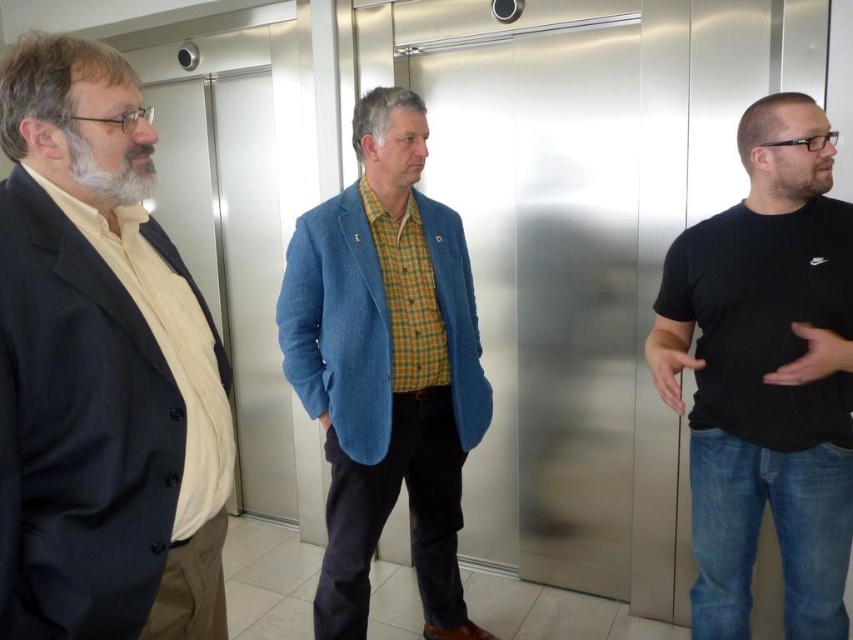
Does matte black suit at left appear on the right side of blue corduroy blazer at center?

Incorrect, matte black suit at left is not on the right side of blue corduroy blazer at center.

Who is lower down, matte black suit at left or blue corduroy blazer at center?

blue corduroy blazer at center

Image resolution: width=853 pixels, height=640 pixels. What are the coordinates of `matte black suit at left` in the screenshot? It's located at (102, 369).

Identify the location of matte black suit at left. The image size is (853, 640). (102, 369).

Can you confirm if matte black suit at left is shorter than black cotton t-shirt at right?

Yes.

Image resolution: width=853 pixels, height=640 pixels. I want to click on matte black suit at left, so click(102, 369).

Does black cotton t-shirt at right appear over blue corduroy blazer at center?

Indeed, black cotton t-shirt at right is positioned over blue corduroy blazer at center.

Between point (741, 492) and point (376, 212), which one is positioned in front?

Point (741, 492) is in front.

Measure the distance between black cotton t-shirt at right and camera.

The distance of black cotton t-shirt at right from camera is 1.44 meters.

Identify the location of black cotton t-shirt at right. Image resolution: width=853 pixels, height=640 pixels. (766, 376).